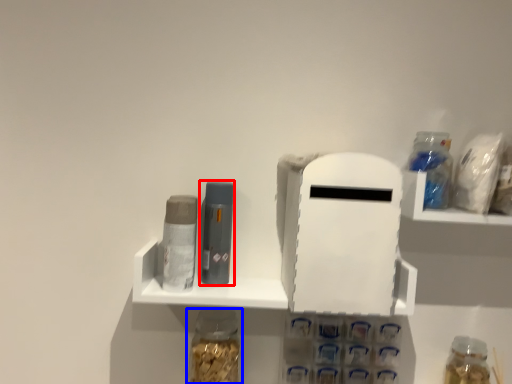
Question: Which point is closer to the camera, toiletry (highlighted by a red box) or bottle (highlighted by a blue box)?

Choices:
 (A) toiletry
 (B) bottle

Answer: (B)